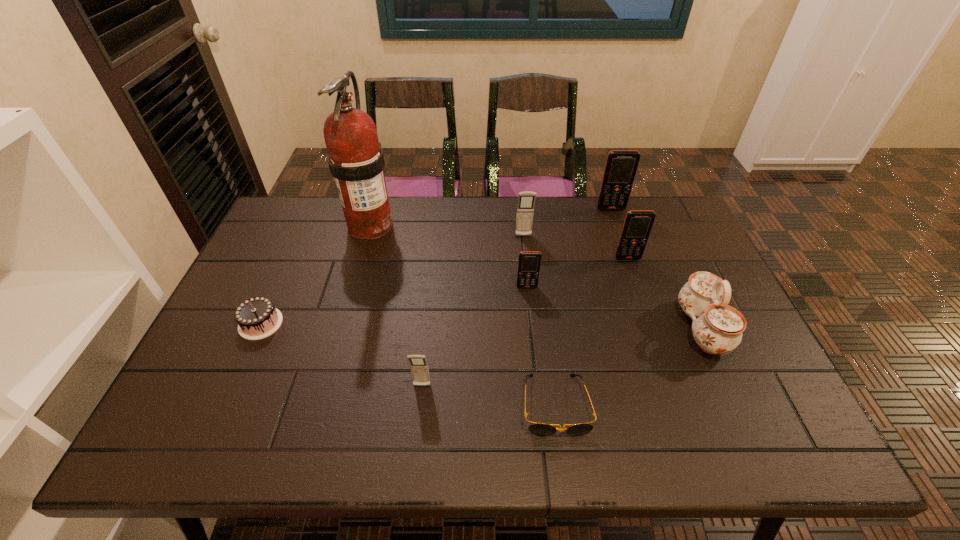
I want to click on the leftmost orange cellular telephone, so click(529, 262).

In order to click on the second nearest cellular telephone in this screenshot , I will do `click(529, 262)`.

Where is `the nearer gray cellular telephone`? Image resolution: width=960 pixels, height=540 pixels. the nearer gray cellular telephone is located at coordinates (419, 367).

At what (x,y) coordinates should I click in order to perform the action: click on the third object from left to right. Please return your answer as a coordinate pair (x, y). Looking at the image, I should click on (419, 367).

I want to click on the eighth tallest object, so [x=257, y=318].

The width and height of the screenshot is (960, 540). In order to click on chocolate cake in this screenshot , I will do `click(257, 318)`.

This screenshot has width=960, height=540. I want to click on sunglasses, so click(542, 429).

At what (x,y) coordinates should I click in order to perform the action: click on black sunglasses. Please return your answer as a coordinate pair (x, y). Looking at the image, I should click on (542, 429).

The height and width of the screenshot is (540, 960). What are the coordinates of `vacant point located at the nozzle of the fire extinguisher` in the screenshot? It's located at click(335, 353).

Identify the location of vacant point located on the screen of the biggest orange cellular telephone. The width and height of the screenshot is (960, 540). [641, 296].